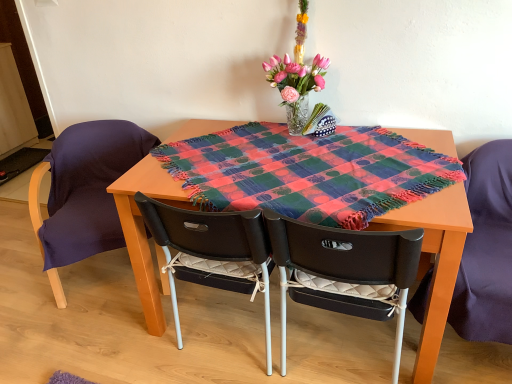
Question: Is purple fabric chair at left, which appears as the 4th chair when viewed from the right, in contact with matte black chair at right, the first chair positioned from the right?

Choices:
 (A) no
 (B) yes

Answer: (A)

Question: Is purple fabric chair at left, placed as the 1th chair when sorted from left to right, located outside matte black chair at right, positioned as the 4th chair in left-to-right order?

Choices:
 (A) yes
 (B) no

Answer: (A)

Question: Does purple fabric chair at left, placed as the 1th chair when sorted from left to right, lie behind matte black chair at right, the first chair positioned from the right?

Choices:
 (A) no
 (B) yes

Answer: (B)

Question: From a real-world perspective, is purple fabric chair at left, which appears as the 4th chair when viewed from the right, located higher than matte black chair at right, positioned as the 4th chair in left-to-right order?

Choices:
 (A) no
 (B) yes

Answer: (A)

Question: From the image's perspective, would you say purple fabric chair at left, placed as the 1th chair when sorted from left to right, is positioned over matte black chair at right, the first chair positioned from the right?

Choices:
 (A) yes
 (B) no

Answer: (A)

Question: Does purple fabric chair at left, placed as the 1th chair when sorted from left to right, appear on the right side of matte black chair at right, positioned as the 4th chair in left-to-right order?

Choices:
 (A) yes
 (B) no

Answer: (B)

Question: Is black plastic chair with white cushion at center, marked as the 2th chair in a left-to-right arrangement, thinner than matte black chair at right, the first chair positioned from the right?

Choices:
 (A) no
 (B) yes

Answer: (B)

Question: From the image's perspective, is black plastic chair with white cushion at center, marked as the 2th chair in a left-to-right arrangement, over matte black chair at right, positioned as the 4th chair in left-to-right order?

Choices:
 (A) no
 (B) yes

Answer: (A)

Question: Does black plastic chair with white cushion at center, marked as the 2th chair in a left-to-right arrangement, have a larger size compared to matte black chair at right, the first chair positioned from the right?

Choices:
 (A) no
 (B) yes

Answer: (B)

Question: Is black plastic chair with white cushion at center, the third chair positioned from the right, facing towards matte black chair at right, positioned as the 4th chair in left-to-right order?

Choices:
 (A) no
 (B) yes

Answer: (A)

Question: Is the position of black plastic chair with white cushion at center, the third chair positioned from the right, less distant than that of matte black chair at right, positioned as the 4th chair in left-to-right order?

Choices:
 (A) yes
 (B) no

Answer: (B)

Question: Would you say black plastic chair with white cushion at center, marked as the 2th chair in a left-to-right arrangement, contains matte black chair at right, the first chair positioned from the right?

Choices:
 (A) yes
 (B) no

Answer: (B)

Question: Considering the relative sizes of multicolored woven blanket at center and purple fabric chair at left, which appears as the 4th chair when viewed from the right, in the image provided, is multicolored woven blanket at center thinner than purple fabric chair at left, which appears as the 4th chair when viewed from the right,?

Choices:
 (A) no
 (B) yes

Answer: (A)